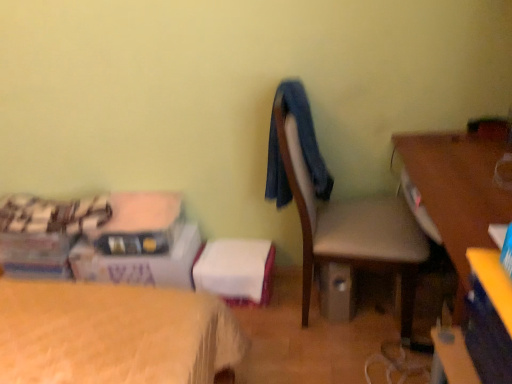
I want to click on matte gray chair at center, so click(352, 229).

In order to face wooden desk at right, should I rotate leftwards or rightwards?

You should look right and rotate roughly 29.309 degrees.

You are a GUI agent. You are given a task and a screenshot of the screen. Output one action in this format:
    pyautogui.click(x=<x>, y=<y>)
    Task: Click on the blue fabric at center
    The image size is (512, 384).
    Given the screenshot: What is the action you would take?
    pyautogui.click(x=306, y=135)

Describe the element at coordinates (141, 263) in the screenshot. I see `white cardboard box at lower left` at that location.

Where is `matte gray chair at center`? matte gray chair at center is located at coordinates (352, 229).

From the image's perspective, does matte gray chair at center appear higher than blue fabric at center?

No, from the image's perspective, matte gray chair at center is not on top of blue fabric at center.

Find the location of a particular element. The image size is (512, 384). chair on the right of blue fabric at center is located at coordinates (352, 229).

From a real-world perspective, which object stands above the other?

blue fabric at center is physically above.

In the scene shown: Is matte gray chair at center looking in the opposite direction of blue fabric at center?

Yes, matte gray chair at center is facing away from blue fabric at center.

How many degrees apart are the facing directions of matte gray chair at center and white cardboard box at lower left?

85.7 degrees separate the facing orientations of matte gray chair at center and white cardboard box at lower left.

From a real-world perspective, is matte gray chair at center physically below white cardboard box at lower left?

No, from a real-world perspective, matte gray chair at center is not under white cardboard box at lower left.

Is matte gray chair at center positioned with its back to white cardboard box at lower left?

Yes, white cardboard box at lower left is at the back of matte gray chair at center.

Which is in front, point (401, 264) or point (86, 267)?

The point (401, 264) is in front.

From a real-world perspective, between matte gray chair at center and wooden desk at right, who is vertically lower?

From a 3D spatial view, wooden desk at right is below.

Can you confirm if matte gray chair at center is wider than wooden desk at right?

No.

Are matte gray chair at center and wooden desk at right far apart?

matte gray chair at center is near wooden desk at right, not far away.

Is matte gray chair at center oriented away from wooden desk at right?

That's not correct — matte gray chair at center is not looking away from wooden desk at right.

Can you see white cardboard box at lower left touching matte gray chair at center?

No, white cardboard box at lower left is not next to matte gray chair at center.

From a real-world perspective, is white cardboard box at lower left on matte gray chair at center?

No, from a real-world perspective, white cardboard box at lower left is not over matte gray chair at center

Which is behind, white cardboard box at lower left or matte gray chair at center?

white cardboard box at lower left.

Is white cardboard box at lower left taller than matte gray chair at center?

No, white cardboard box at lower left is not taller than matte gray chair at center.

At what (x,y) coordinates should I click in order to perform the action: click on chair that is under the blue fabric at center (from a real-world perspective). Please return your answer as a coordinate pair (x, y). This screenshot has width=512, height=384. Looking at the image, I should click on (352, 229).

Considering the relative sizes of blue fabric at center and matte gray chair at center in the image provided, is blue fabric at center bigger than matte gray chair at center?

No, blue fabric at center is not bigger than matte gray chair at center.

Is blue fabric at center wider or thinner than matte gray chair at center?

In the image, blue fabric at center appears to be more narrow than matte gray chair at center.

Is blue fabric at center inside or outside of matte gray chair at center?

blue fabric at center exists entirely within matte gray chair at center.

Is white cardboard box at lower left far from blue fabric at center?

No, white cardboard box at lower left is not far away from blue fabric at center.

In the scene shown: Which is correct: white cardboard box at lower left is inside blue fabric at center, or outside of it?

white cardboard box at lower left exists outside the volume of blue fabric at center.

Considering the relative sizes of white cardboard box at lower left and blue fabric at center in the image provided, is white cardboard box at lower left bigger than blue fabric at center?

Yes, white cardboard box at lower left is bigger than blue fabric at center.

How many degrees apart are the facing directions of white cardboard box at lower left and blue fabric at center?

85.7 degrees.

Between white cardboard box at lower left and wooden desk at right, which one appears on the right side from the viewer's perspective?

From the viewer's perspective, wooden desk at right appears more on the right side.

From a real-world perspective, is white cardboard box at lower left physically above wooden desk at right?

No, from a real-world perspective, white cardboard box at lower left is not above wooden desk at right.

Find the location of a particular element. This screenshot has width=512, height=384. clothing behind the matte gray chair at center is located at coordinates (306, 135).

The image size is (512, 384). Find the location of `box lying below the matte gray chair at center (from the image's perspective)`. box lying below the matte gray chair at center (from the image's perspective) is located at coordinates (141, 263).

From the image, which object appears to be nearer to blue fabric at center, matte gray chair at center or wooden desk at right?

matte gray chair at center is closer to blue fabric at center.

From the image, which object appears to be nearer to blue fabric at center, wooden desk at right or white cardboard box at lower left?

wooden desk at right lies closer to blue fabric at center than the other object.

When comparing their distances from wooden desk at right, does white cardboard box at lower left or blue fabric at center seem further?

Based on the image, white cardboard box at lower left appears to be further to wooden desk at right.

When comparing their distances from blue fabric at center, does white cardboard box at lower left or matte gray chair at center seem further?

Among the two, white cardboard box at lower left is located further to blue fabric at center.

Looking at this image, estimate the real-world distances between objects in this image. Which object is further from blue fabric at center, white cardboard box at lower left or wooden desk at right?

white cardboard box at lower left.

Based on their spatial positions, is matte gray chair at center or wooden desk at right further from white cardboard box at lower left?

Based on the image, wooden desk at right appears to be further to white cardboard box at lower left.

Based on their spatial positions, is white cardboard box at lower left or blue fabric at center closer to matte gray chair at center?

blue fabric at center lies closer to matte gray chair at center than the other object.

From the image, which object appears to be farther from white cardboard box at lower left, blue fabric at center or wooden desk at right?

wooden desk at right lies further to white cardboard box at lower left than the other object.

Identify the location of chair situated between white cardboard box at lower left and wooden desk at right from left to right. (352, 229).

Where is `clothing situated between white cardboard box at lower left and wooden desk at right from left to right`? clothing situated between white cardboard box at lower left and wooden desk at right from left to right is located at coordinates (306, 135).

This screenshot has height=384, width=512. What are the coordinates of `chair between wooden desk at right and blue fabric at center along the z-axis` in the screenshot? It's located at coord(352,229).

Locate an element on the screen. This screenshot has width=512, height=384. clothing between white cardboard box at lower left and matte gray chair at center is located at coordinates (306, 135).